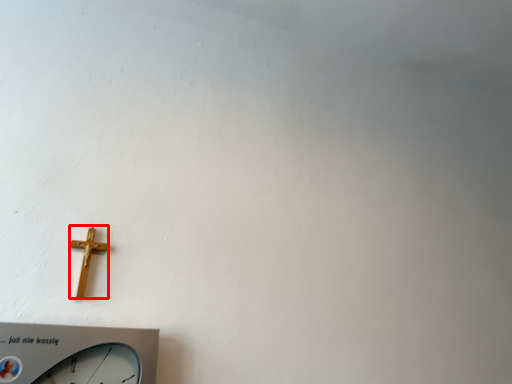
Question: From the image's perspective, where is crucifix (annotated by the red box) located relative to wall clock?

Choices:
 (A) above
 (B) below

Answer: (A)